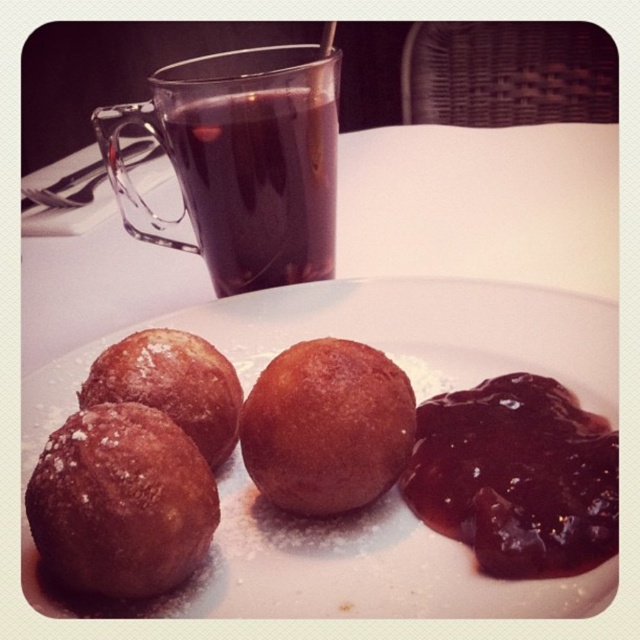
Does shiny dark jam at lower right appear over golden brown doughnut at center?

No.

Is point (580, 513) positioned in front of point (304, 420)?

Yes, it is in front of point (304, 420).

Where is `shiny dark jam at lower right`? The width and height of the screenshot is (640, 640). shiny dark jam at lower right is located at coordinates (516, 476).

Who is lower down, sugared doughnuts at center or sugared brown donut at center?

sugared doughnuts at center

Which is more to the left, sugared doughnuts at center or sugared brown donut at center?

sugared brown donut at center

Where is `sugared doughnuts at center`? Image resolution: width=640 pixels, height=640 pixels. sugared doughnuts at center is located at coordinates (378, 339).

Can you confirm if crispy golden-brown donut at lower left is positioned to the left of golden brown doughnut at center?

Indeed, crispy golden-brown donut at lower left is positioned on the left side of golden brown doughnut at center.

Can you confirm if crispy golden-brown donut at lower left is bigger than golden brown doughnut at center?

Incorrect, crispy golden-brown donut at lower left is not larger than golden brown doughnut at center.

You are a GUI agent. You are given a task and a screenshot of the screen. Output one action in this format:
    pyautogui.click(x=<x>, y=<y>)
    Task: Click on the crispy golden-brown donut at lower left
    
    Given the screenshot: What is the action you would take?
    pyautogui.click(x=120, y=502)